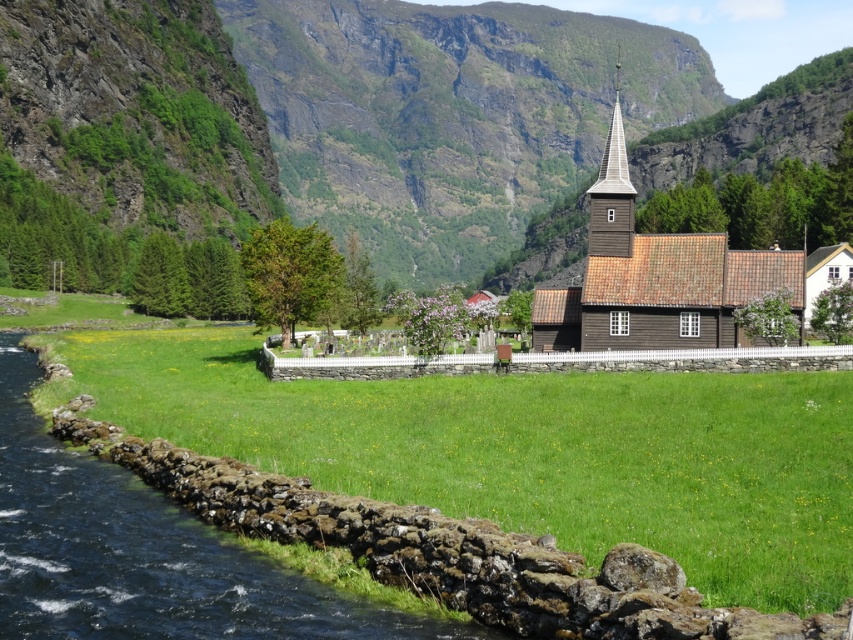
Question: Which point is closer to the camera?

Choices:
 (A) (712, 280)
 (B) (264, 83)

Answer: (A)

Question: Does brown wooden church at center have a lesser width compared to brown wooden spire at upper center?

Choices:
 (A) yes
 (B) no

Answer: (A)

Question: Estimate the real-world distances between objects in this image. Which object is farther from the green grass at center?

Choices:
 (A) brown wooden church at center
 (B) green grassy field at lower center

Answer: (B)

Question: Which of the following is the farthest from the observer?

Choices:
 (A) brown wooden spire at upper center
 (B) brown wooden church at center
 (C) green grass at center

Answer: (A)

Question: Is brown wooden church at center closer to camera compared to brown wooden spire at upper center?

Choices:
 (A) no
 (B) yes

Answer: (B)

Question: Does green grassy field at lower center appear on the right side of brown wooden church at center?

Choices:
 (A) no
 (B) yes

Answer: (A)